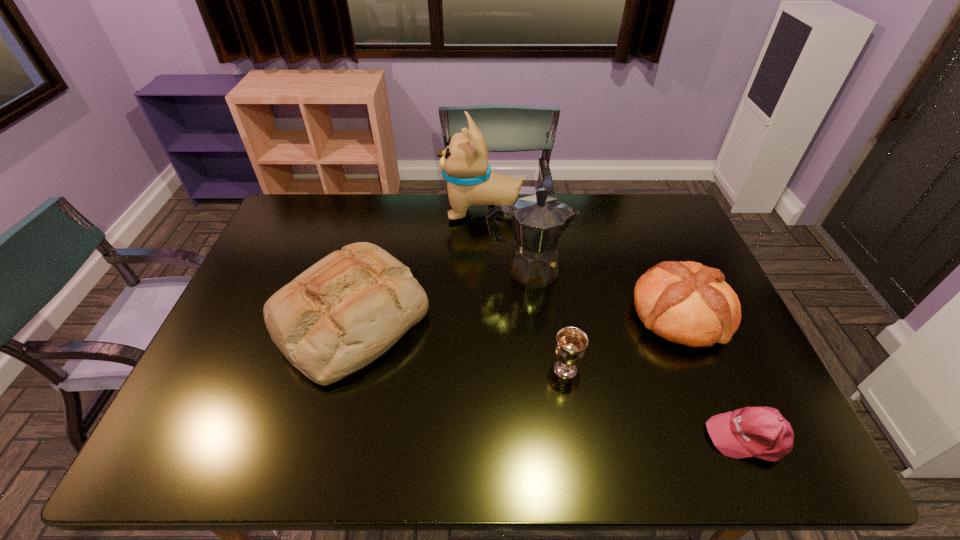
Image resolution: width=960 pixels, height=540 pixels. I want to click on the farthest object, so click(464, 163).

The image size is (960, 540). In order to click on the second tallest object in this screenshot , I will do `click(538, 221)`.

Identify the location of the left bread. tap(345, 311).

At what (x,y) coordinates should I click in order to perform the action: click on the taller bread. Please return your answer as a coordinate pair (x, y). This screenshot has height=540, width=960. Looking at the image, I should click on (345, 311).

At what (x,y) coordinates should I click in order to perform the action: click on the shorter bread. Please return your answer as a coordinate pair (x, y). The width and height of the screenshot is (960, 540). Looking at the image, I should click on (687, 303).

At what (x,y) coordinates should I click in order to perform the action: click on the fifth tallest object. Please return your answer as a coordinate pair (x, y). Looking at the image, I should click on (570, 347).

Image resolution: width=960 pixels, height=540 pixels. Find the location of `baseball cap`. baseball cap is located at coordinates (762, 432).

Locate an element on the screen. This screenshot has height=540, width=960. the nearest object is located at coordinates (762, 432).

Locate an element on the screen. free space located on the face of the puppy is located at coordinates pos(409,210).

I want to click on vacant space located 0.280m on the face of the puppy, so click(x=365, y=210).